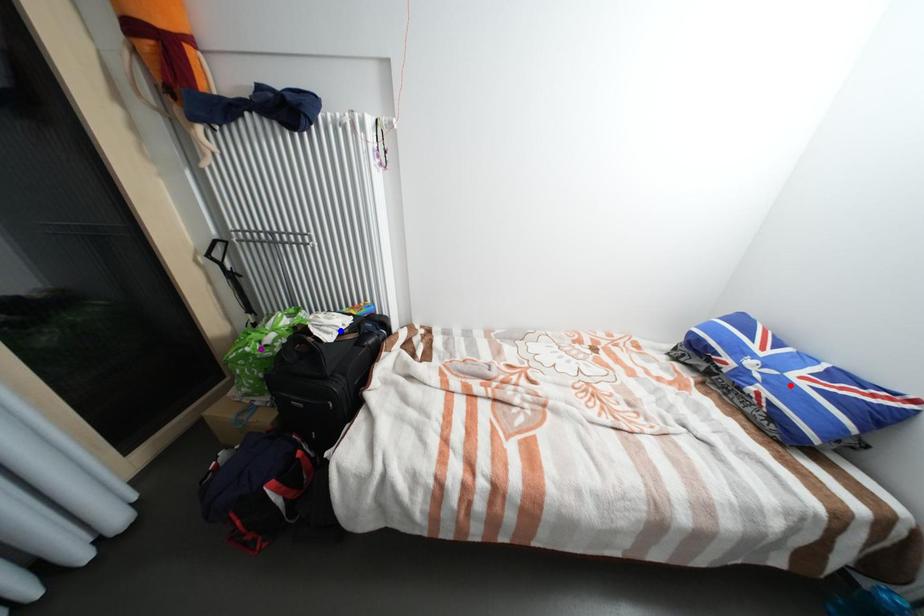
Order these from nearest to farthest:
red point | purple point | blue point

red point < purple point < blue point